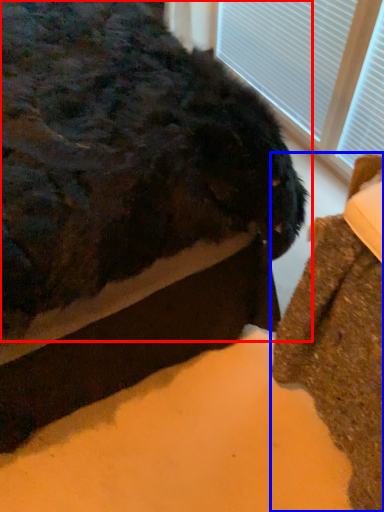
Question: Which point is closer to the camera, animal (highlighted by a red box) or furniture (highlighted by a blue box)?

Choices:
 (A) animal
 (B) furniture

Answer: (A)